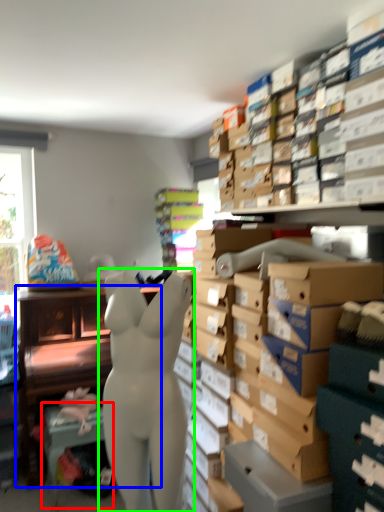
Question: Considering the real-world distances, which object is farthest from table (highlighted by a red box)? furniture (highlighted by a blue box) or person (highlighted by a green box)?

Choices:
 (A) furniture
 (B) person

Answer: (B)